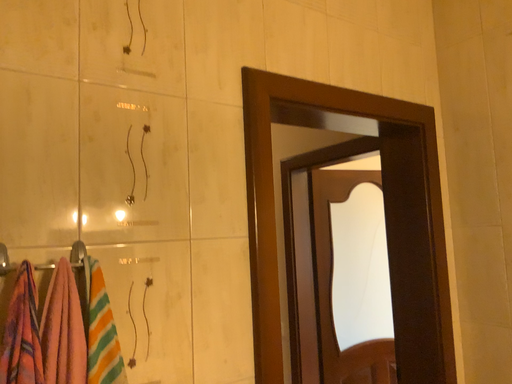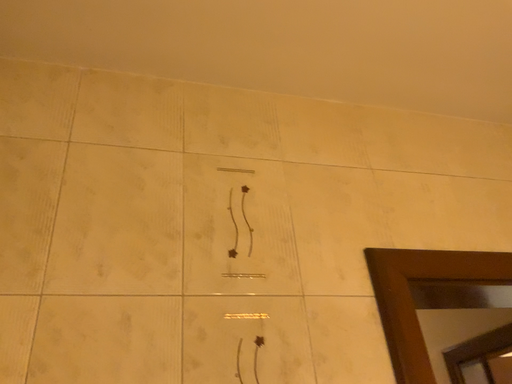
Question: Which way did the camera rotate in the video?

Choices:
 (A) rotated right
 (B) rotated left

Answer: (B)